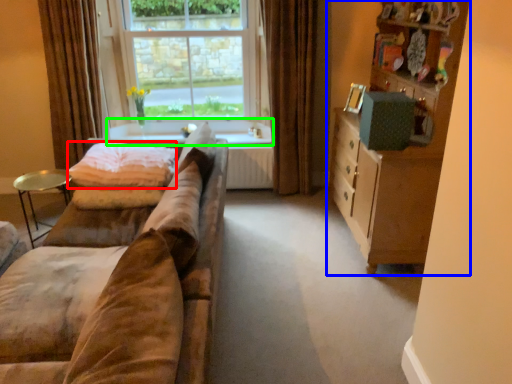
Question: Which object is the farthest from blanket (highlighted by a red box)? Choose among these: cabinetry (highlighted by a blue box) or window sill (highlighted by a green box).

Choices:
 (A) cabinetry
 (B) window sill

Answer: (A)